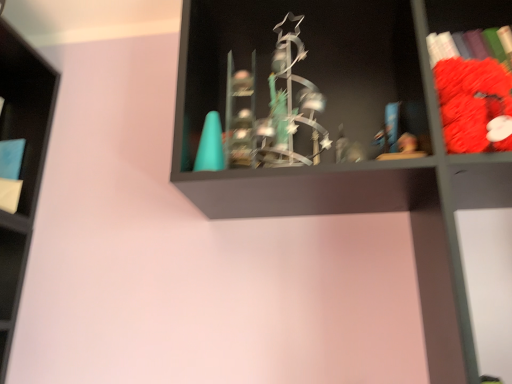
In order to face blue matte book at left, which is counted as the second book, starting from the front, should I rotate leftwards or rightwards?

To align with it, rotate left about 30.366°.

Find the location of a particular element. This screenshot has height=384, width=512. metallic statue at center is located at coordinates (351, 127).

Between velvet red plush toy at right, acting as the second book starting from the back, and metallic statue at center, which one is positioned behind?

velvet red plush toy at right, acting as the second book starting from the back, is further away from the camera.

Between velvet red plush toy at right, acting as the first book starting from the right, and metallic statue at center, which one has less height?

Standing shorter between the two is velvet red plush toy at right, acting as the first book starting from the right.

From a real-world perspective, is velvet red plush toy at right, acting as the second book starting from the back, on metallic statue at center?

Yes, from a real-world perspective, velvet red plush toy at right, acting as the second book starting from the back, is over metallic statue at center

Would you say velvet red plush toy at right, placed as the second book when sorted from left to right, is outside metallic statue at center?

Actually, velvet red plush toy at right, placed as the second book when sorted from left to right, is within metallic statue at center.

Is blue matte book at left, placed as the 1th book when sorted from left to right, to the right of metallic statue at center from the viewer's perspective?

Incorrect, blue matte book at left, placed as the 1th book when sorted from left to right, is not on the right side of metallic statue at center.

From the image's perspective, between blue matte book at left, which is counted as the second book, starting from the front, and metallic statue at center, which one is located above?

blue matte book at left, which is counted as the second book, starting from the front, appears higher in the image.

How different are the orientations of velvet red plush toy at right, placed as the second book when sorted from left to right, and blue matte book at left, which is the 2th book in right-to-left order, in degrees?

4.61 degrees separate the facing orientations of velvet red plush toy at right, placed as the second book when sorted from left to right, and blue matte book at left, which is the 2th book in right-to-left order.

From the image's perspective, relative to blue matte book at left, which is the 2th book in right-to-left order, is velvet red plush toy at right, acting as the first book starting from the right, above or below?

From the image's perspective, velvet red plush toy at right, acting as the first book starting from the right, appears above blue matte book at left, which is the 2th book in right-to-left order.

From the picture: Is velvet red plush toy at right, acting as the second book starting from the back, taller or shorter than blue matte book at left, which is the 2th book in right-to-left order?

Considering their sizes, velvet red plush toy at right, acting as the second book starting from the back, has more height than blue matte book at left, which is the 2th book in right-to-left order.

Can you confirm if blue matte book at left, placed as the 1th book when sorted from left to right, is positioned to the left of velvet red plush toy at right, the 1th book positioned from the front?

Indeed, blue matte book at left, placed as the 1th book when sorted from left to right, is positioned on the left side of velvet red plush toy at right, the 1th book positioned from the front.

Do you think blue matte book at left, positioned as the 1th book in back-to-front order, is within velvet red plush toy at right, acting as the second book starting from the back, or outside of it?

blue matte book at left, positioned as the 1th book in back-to-front order, is not inside velvet red plush toy at right, acting as the second book starting from the back, it's outside.

Which object is closer to the camera taking this photo, blue matte book at left, positioned as the 1th book in back-to-front order, or velvet red plush toy at right, acting as the first book starting from the right?

velvet red plush toy at right, acting as the first book starting from the right.

From the image's perspective, which object appears higher, blue matte book at left, which is counted as the second book, starting from the front, or velvet red plush toy at right, acting as the first book starting from the right?

velvet red plush toy at right, acting as the first book starting from the right, from the image's perspective.

From a real-world perspective, who is located higher, metallic statue at center or velvet red plush toy at right, the 1th book positioned from the front?

In real-world perspective, velvet red plush toy at right, the 1th book positioned from the front, is above.

Which object is more forward, metallic statue at center or velvet red plush toy at right, acting as the second book starting from the back?

metallic statue at center is in front.

You are a GUI agent. You are given a task and a screenshot of the screen. Output one action in this format:
    pyautogui.click(x=<x>, y=<y>)
    Task: Click on the shelf that appears below the velvet red plush toy at right, acting as the first book starting from the right (from a real-world perspective)
    This screenshot has width=512, height=384.
    Given the screenshot: What is the action you would take?
    coord(351,127)

Are metallic statue at center and blue matte book at left, placed as the 1th book when sorted from left to right, located far from each other?

metallic statue at center is near blue matte book at left, placed as the 1th book when sorted from left to right, not far away.

What's the angular difference between metallic statue at center and blue matte book at left, placed as the 1th book when sorted from left to right,'s facing directions?

metallic statue at center and blue matte book at left, placed as the 1th book when sorted from left to right, are facing 1.92 degrees away from each other.

Which is more to the left, metallic statue at center or blue matte book at left, which is counted as the second book, starting from the front?

blue matte book at left, which is counted as the second book, starting from the front, is more to the left.

Where is `book that appears on the right of metallic statue at center`? Image resolution: width=512 pixels, height=384 pixels. book that appears on the right of metallic statue at center is located at coordinates click(x=471, y=98).

From the image's perspective, which book is the 1st one above the metallic statue at center? Please provide its 2D coordinates.

[(10, 173)]

From the image, which object appears to be farther from velvet red plush toy at right, acting as the first book starting from the right, blue matte book at left, which is the 2th book in right-to-left order, or metallic statue at center?

Among the two, blue matte book at left, which is the 2th book in right-to-left order, is located further to velvet red plush toy at right, acting as the first book starting from the right.

From the image, which object appears to be farther from metallic statue at center, velvet red plush toy at right, acting as the second book starting from the back, or blue matte book at left, which is the 2th book in right-to-left order?

The object further to metallic statue at center is blue matte book at left, which is the 2th book in right-to-left order.

Which object lies nearer to the anchor point velvet red plush toy at right, acting as the second book starting from the back, metallic statue at center or blue matte book at left, positioned as the 1th book in back-to-front order?

The object closer to velvet red plush toy at right, acting as the second book starting from the back, is metallic statue at center.

Which object lies further to the anchor point blue matte book at left, placed as the 1th book when sorted from left to right, metallic statue at center or velvet red plush toy at right, acting as the second book starting from the back?

velvet red plush toy at right, acting as the second book starting from the back, is further to blue matte book at left, placed as the 1th book when sorted from left to right.

Looking at the image, which one is located further to blue matte book at left, placed as the 1th book when sorted from left to right, velvet red plush toy at right, acting as the second book starting from the back, or metallic statue at center?

velvet red plush toy at right, acting as the second book starting from the back, is positioned further to the anchor blue matte book at left, placed as the 1th book when sorted from left to right.

Estimate the real-world distances between objects in this image. Which object is further from metallic statue at center, blue matte book at left, which is counted as the second book, starting from the front, or velvet red plush toy at right, placed as the second book when sorted from left to right?

Among the two, blue matte book at left, which is counted as the second book, starting from the front, is located further to metallic statue at center.

This screenshot has width=512, height=384. Find the location of `shelf between blue matte book at left, placed as the 1th book when sorted from left to right, and velvet red plush toy at right, placed as the second book when sorted from left to right`. shelf between blue matte book at left, placed as the 1th book when sorted from left to right, and velvet red plush toy at right, placed as the second book when sorted from left to right is located at coordinates (351, 127).